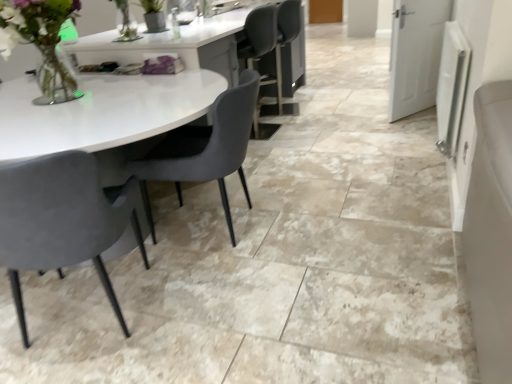
Identify the location of vacant area that is situated to the right of matte gray chair at left, which is counted as the 1th chair, starting from the left. (208, 310).